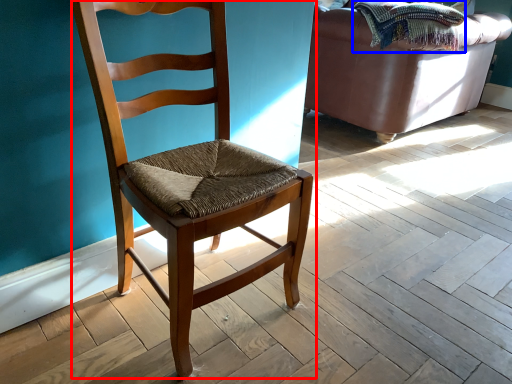
Question: Which object appears farthest to the camera in this image, chair (highlighted by a red box) or blanket (highlighted by a blue box)?

Choices:
 (A) chair
 (B) blanket

Answer: (B)